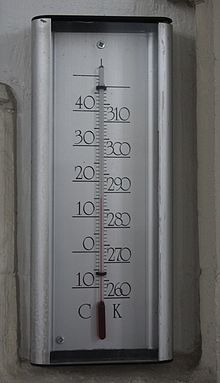
This screenshot has height=383, width=220. Find the location of `bracket`. bracket is located at coordinates (115, 77), (100, 87).